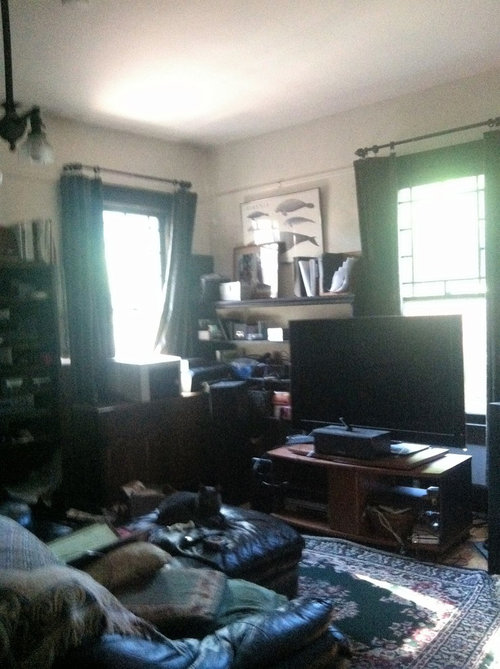
Find the location of a particular element. Image resolution: width=500 pixels, height=669 pixels. curtains is located at coordinates (494, 252), (388, 235), (185, 243), (87, 267).